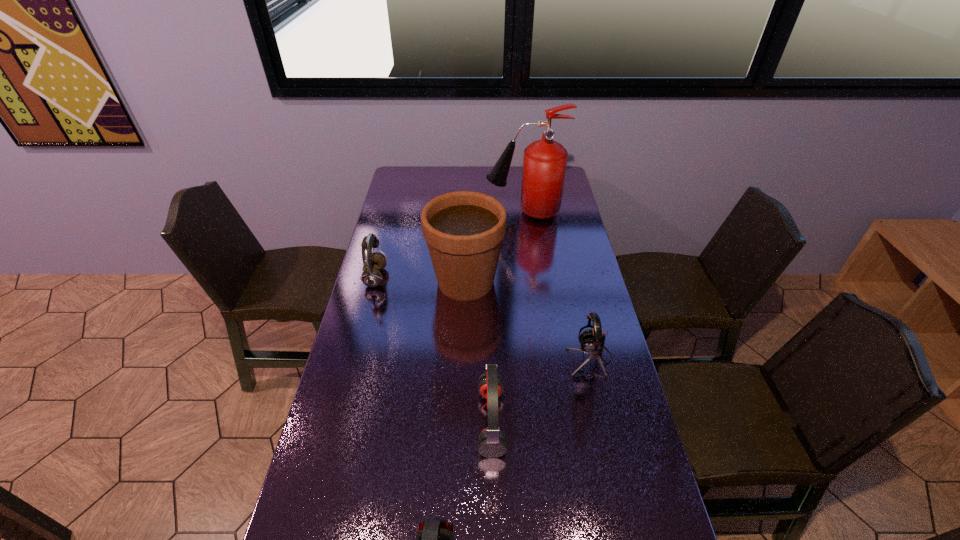
Locate an element on the screen. earphone that is at the right edge is located at coordinates (592, 342).

I want to click on vacant space at the far edge of the desktop, so click(x=462, y=185).

In order to click on vacant space at the left edge of the desktop in this screenshot , I will do (x=420, y=192).

What are the coordinates of `vacant space at the right edge of the desktop` in the screenshot? It's located at (605, 346).

This screenshot has height=540, width=960. I want to click on empty space between the fire extinguisher and the rightmost earphone, so click(557, 285).

Identify the location of vacant space that is in between the farthest earphone and the flowerpot. (420, 280).

The width and height of the screenshot is (960, 540). In order to click on unoccupied position between the third farthest earphone and the farthest earphone in this screenshot , I will do `click(433, 349)`.

This screenshot has height=540, width=960. Find the location of `blank region between the farthest object and the second earphone from right to left`. blank region between the farthest object and the second earphone from right to left is located at coordinates (508, 316).

I want to click on object that can be found as the fourth closest to the nearest earphone, so click(x=373, y=262).

Identify which object is the third closest to the nearest earphone. Please provide its 2D coordinates. Your answer should be formatted as a tuple, i.e. [(x, y)], where the tuple contains the x and y coordinates of a point satisfying the conditions above.

[(464, 230)]